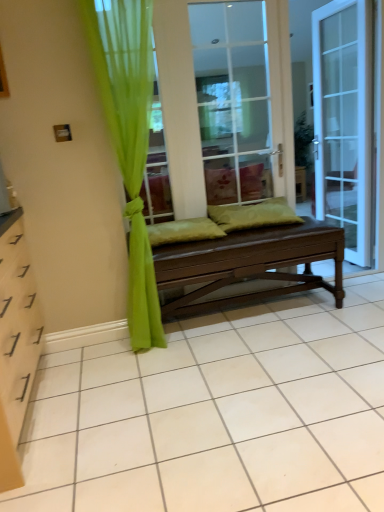
Question: Based on their positions, is brown wooden bench at center located to the left or right of green sheer curtain at left?

Choices:
 (A) left
 (B) right

Answer: (B)

Question: Is brown wooden bench at center in front of or behind green sheer curtain at left in the image?

Choices:
 (A) front
 (B) behind

Answer: (B)

Question: Which of these objects is positioned closest to the green fabric pillow at center, the second pillow viewed from the right?

Choices:
 (A) green sheer curtain at left
 (B) green fabric pillow at center, positioned as the 2th pillow in left-to-right order
 (C) brown wooden bench at center
 (D) matte brown bench at center
 (E) white glass door at right

Answer: (B)

Question: Which is nearer to the brown wooden bench at center?

Choices:
 (A) green fabric pillow at center, positioned as the 2th pillow in left-to-right order
 (B) green fabric pillow at center, which is the first pillow in left-to-right order
 (C) green sheer curtain at left
 (D) white glass door at right
 (E) matte brown bench at center

Answer: (A)